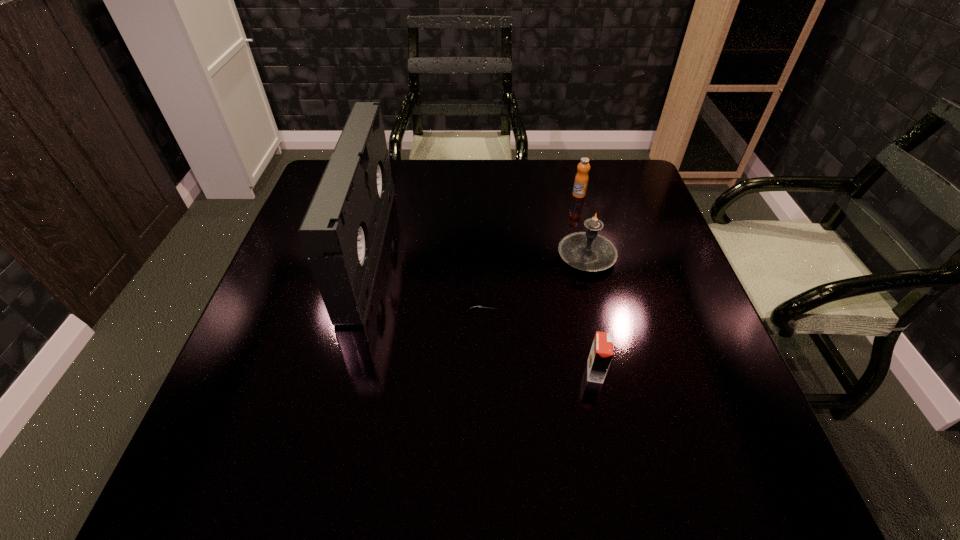
Find the location of `vacant space that satisfies the following two spatial constraints: 1. on the side of the leftmost object with visible spindles; 2. on the back side of the fourth shortest object`. vacant space that satisfies the following two spatial constraints: 1. on the side of the leftmost object with visible spindles; 2. on the back side of the fourth shortest object is located at coordinates tap(367, 256).